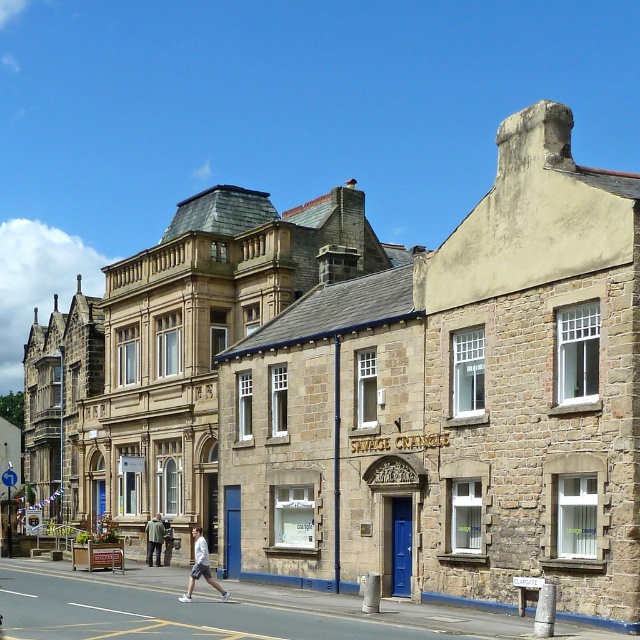
Question: Which point appears closest to the camera in this image?

Choices:
 (A) (160, 531)
 (B) (168, 528)

Answer: (A)

Question: Is khaki fabric jacket at center to the right of light gray fabric jacket at center from the viewer's perspective?

Choices:
 (A) yes
 (B) no

Answer: (B)

Question: Which object is farther from the camera taking this photo?

Choices:
 (A) khaki fabric jacket at center
 (B) light gray cotton shorts at center

Answer: (A)

Question: Which of these objects is positioned farthest from the light gray cotton shorts at center?

Choices:
 (A) light gray fabric jacket at center
 (B) khaki fabric jacket at center

Answer: (B)

Question: Is light gray cotton shorts at center further to camera compared to khaki fabric jacket at center?

Choices:
 (A) no
 (B) yes

Answer: (A)

Question: Can you confirm if light gray cotton shorts at center is positioned to the right of khaki fabric jacket at center?

Choices:
 (A) no
 (B) yes

Answer: (B)